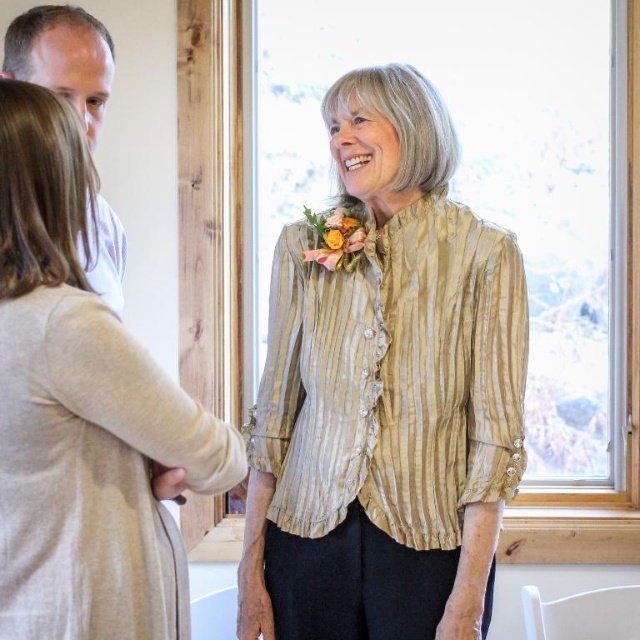
Question: In this image, where is gold striped blouse at center located relative to vibrant floral bouquet at center?

Choices:
 (A) right
 (B) left

Answer: (A)

Question: Which object is closer to the camera taking this photo?

Choices:
 (A) gold striped blouse at center
 (B) white cotton shirt at upper left
 (C) light beige textured cardigan at left
 (D) vibrant floral bouquet at center

Answer: (C)

Question: Which point is farther to the camera?

Choices:
 (A) vibrant floral bouquet at center
 (B) light beige textured cardigan at left
 (C) white cotton shirt at upper left
 (D) gold striped blouse at center

Answer: (A)

Question: Which point appears closest to the camera in this image?

Choices:
 (A) (349, 172)
 (B) (339, 220)
 (C) (90, 35)
 (D) (72, 401)

Answer: (D)

Question: Is gold striped blouse at center bigger than light beige textured cardigan at left?

Choices:
 (A) no
 (B) yes

Answer: (B)

Question: Does light beige textured cardigan at left appear on the right side of vibrant floral bouquet at center?

Choices:
 (A) no
 (B) yes

Answer: (A)